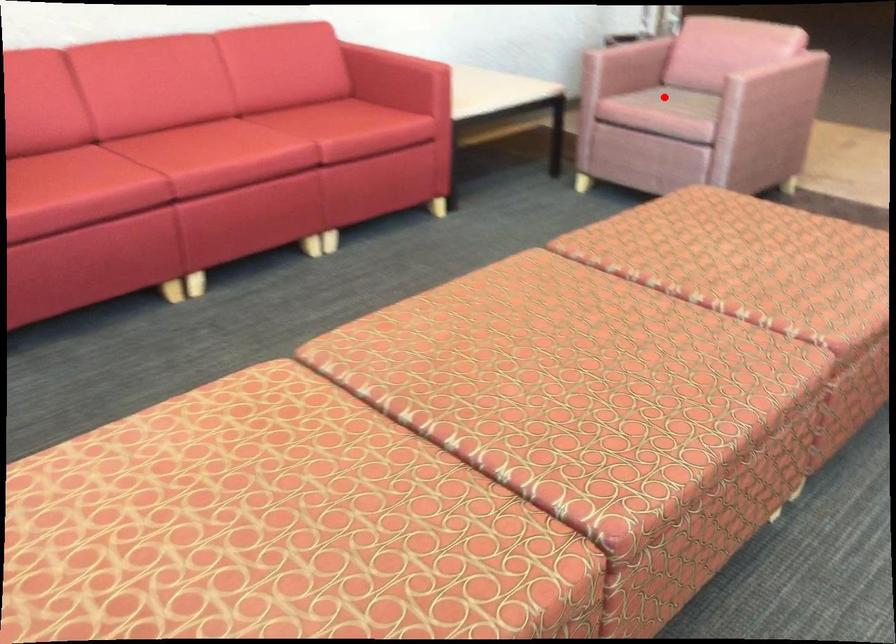
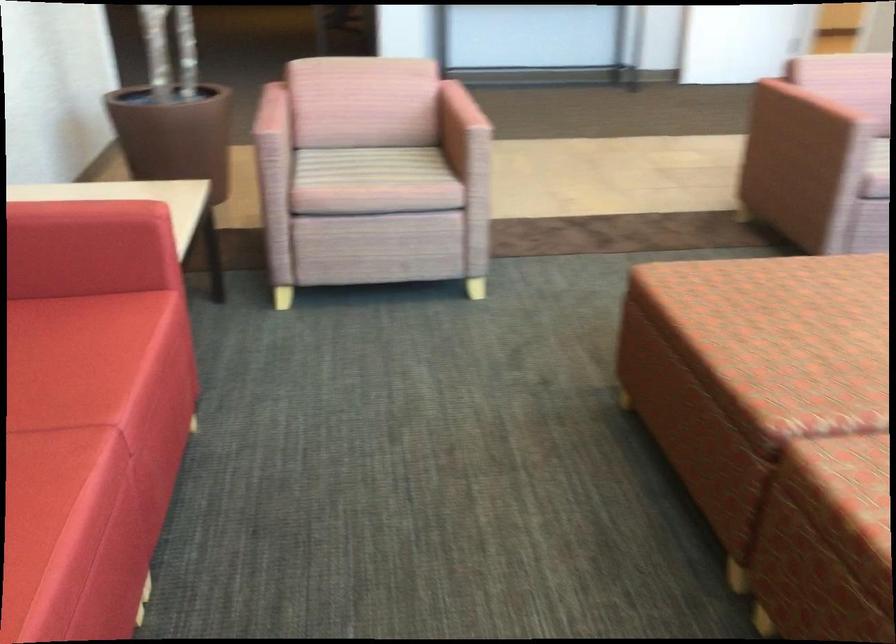
Question: I am providing you with two images of the same scene from different viewpoints. Image1 has a red point marked. In image2, the corresponding 3D location appears at what relative position? Reply with the corresponding letter.

Choices:
 (A) Closer
 (B) Farther

Answer: (A)